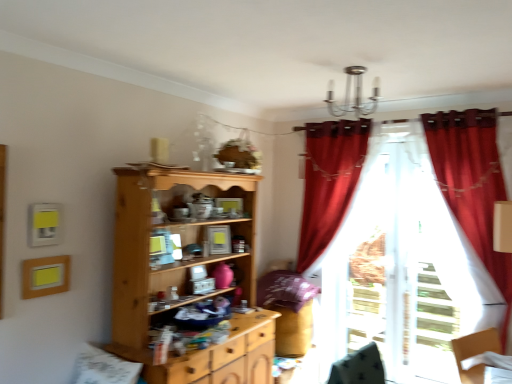
Question: Does velvet red curtain at right, which ranks as the first curtain in front-to-back order, have a larger size compared to light wood cupboard at center?

Choices:
 (A) no
 (B) yes

Answer: (A)

Question: Can you confirm if velvet red curtain at right, which ranks as the first curtain in front-to-back order, is wider than light wood cupboard at center?

Choices:
 (A) yes
 (B) no

Answer: (B)

Question: From a real-world perspective, is velvet red curtain at right, which ranks as the first curtain in front-to-back order, over light wood cupboard at center?

Choices:
 (A) yes
 (B) no

Answer: (A)

Question: Considering the relative sizes of velvet red curtain at right, which ranks as the first curtain in front-to-back order, and light wood cupboard at center in the image provided, is velvet red curtain at right, which ranks as the first curtain in front-to-back order, shorter than light wood cupboard at center?

Choices:
 (A) no
 (B) yes

Answer: (A)

Question: Does velvet red curtain at right, the second curtain when ordered from back to front, lie behind light wood cupboard at center?

Choices:
 (A) yes
 (B) no

Answer: (A)

Question: From their relative heights in the image, would you say translucent white curtain at right, the 2th curtain positioned from the front, is taller or shorter than velvet red curtain at right, which ranks as the first curtain in front-to-back order?

Choices:
 (A) short
 (B) tall

Answer: (B)

Question: Is point (451, 226) closer or farther from the camera than point (470, 205)?

Choices:
 (A) closer
 (B) farther

Answer: (B)

Question: From the image's perspective, is translucent white curtain at right, the 2th curtain positioned from the front, located above or below velvet red curtain at right, the second curtain when ordered from back to front?

Choices:
 (A) above
 (B) below

Answer: (B)

Question: From a real-world perspective, is translucent white curtain at right, which appears as the first curtain when viewed from the back, above or below velvet red curtain at right, which ranks as the first curtain in front-to-back order?

Choices:
 (A) below
 (B) above

Answer: (A)

Question: Based on their sizes in the image, would you say light wood cupboard at center is bigger or smaller than velvet red curtain at right, the second curtain when ordered from back to front?

Choices:
 (A) small
 (B) big

Answer: (B)

Question: From a real-world perspective, is light wood cupboard at center physically located above or below velvet red curtain at right, the second curtain when ordered from back to front?

Choices:
 (A) above
 (B) below

Answer: (B)

Question: From the image's perspective, is light wood cupboard at center located above or below velvet red curtain at right, the second curtain when ordered from back to front?

Choices:
 (A) above
 (B) below

Answer: (B)

Question: Considering the positions of point (139, 317) and point (465, 220), is point (139, 317) closer or farther from the camera than point (465, 220)?

Choices:
 (A) closer
 (B) farther

Answer: (A)

Question: From the image's perspective, is velvet red curtain at right, the second curtain when ordered from back to front, located above or below light wood cupboard at center?

Choices:
 (A) above
 (B) below

Answer: (A)

Question: Is point (465, 198) positioned closer to the camera than point (245, 200)?

Choices:
 (A) closer
 (B) farther

Answer: (A)